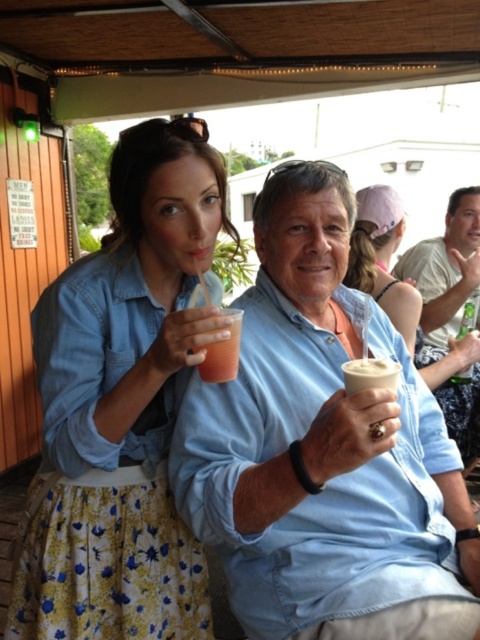
Question: Which object appears closest to the camera in this image?

Choices:
 (A) floral skirt at center
 (B) white creamy cup at center

Answer: (B)

Question: Is light blue shirt at center above floral skirt at center?

Choices:
 (A) no
 (B) yes

Answer: (B)

Question: Which point appears closest to the camera in this image?

Choices:
 (A) (368, 376)
 (B) (256, 513)
 (C) (36, 531)

Answer: (A)

Question: Is light blue shirt at center further to camera compared to matte pink hat at upper center?

Choices:
 (A) no
 (B) yes

Answer: (A)

Question: Which of the following is the farthest from the observer?

Choices:
 (A) (362, 620)
 (B) (372, 260)
 (C) (171, 316)

Answer: (B)

Question: Does matte blue shirt at center appear over translucent plastic cup at center?

Choices:
 (A) yes
 (B) no

Answer: (A)